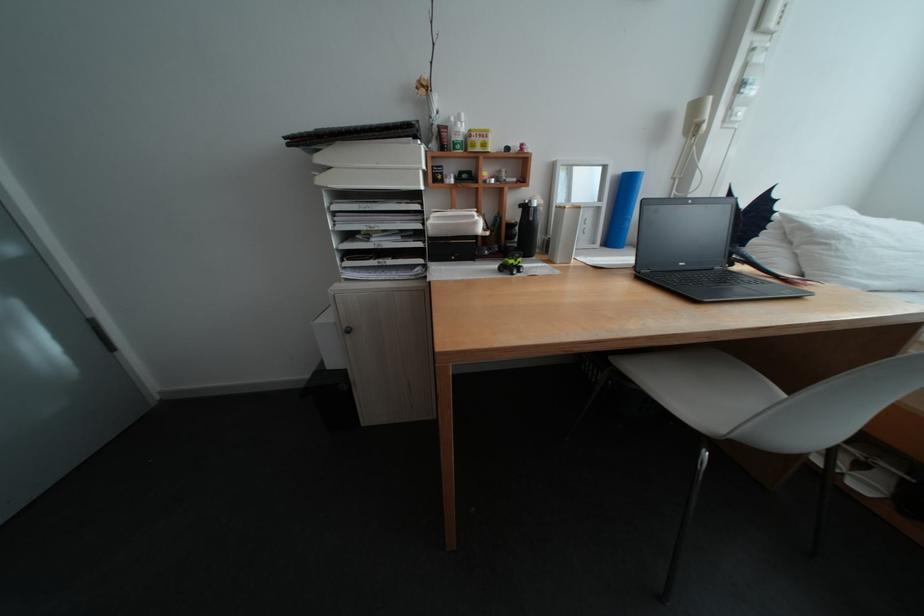
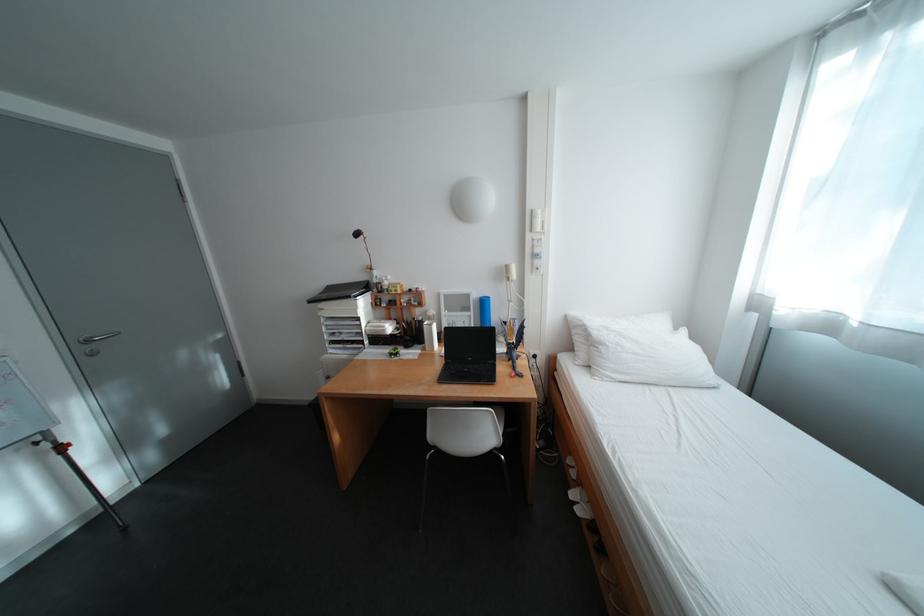
In the second image, find the point that corresponds to the point at 616,205 in the first image.

(484, 314)